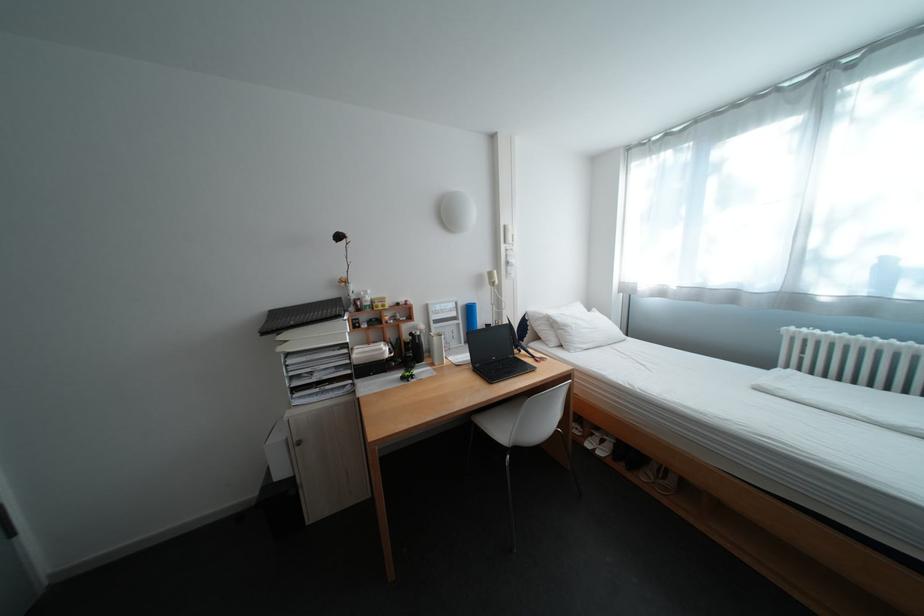
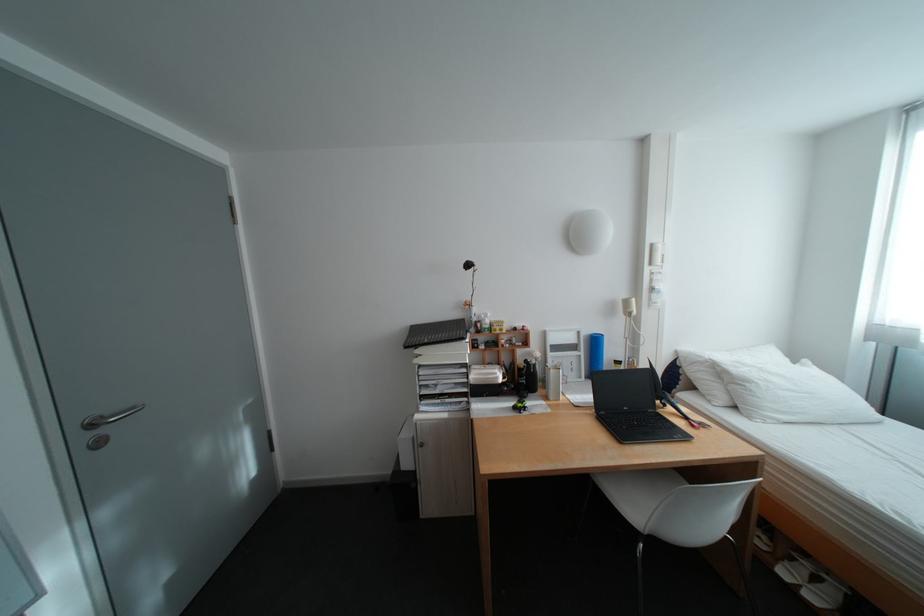
Question: I am providing you with two images of the same scene from different viewpoints. Which of the following objects are not visible in image2?

Choices:
 (A) white shoe
 (B) blue water bottle
 (C) white pillow
 (D) none of these

Answer: (D)